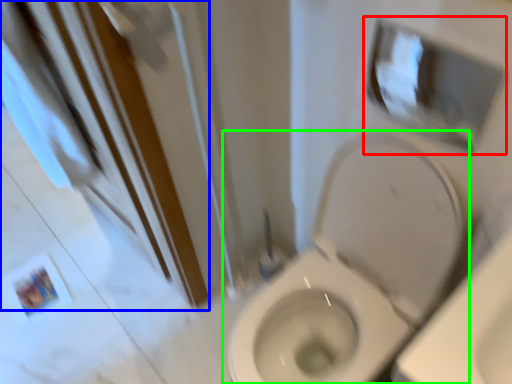
Question: Based on their relative distances, which object is nearer to medicine cabinet (highlighted by a red box)? Choose from screen door (highlighted by a blue box) and toilet (highlighted by a green box).

Choices:
 (A) screen door
 (B) toilet

Answer: (B)